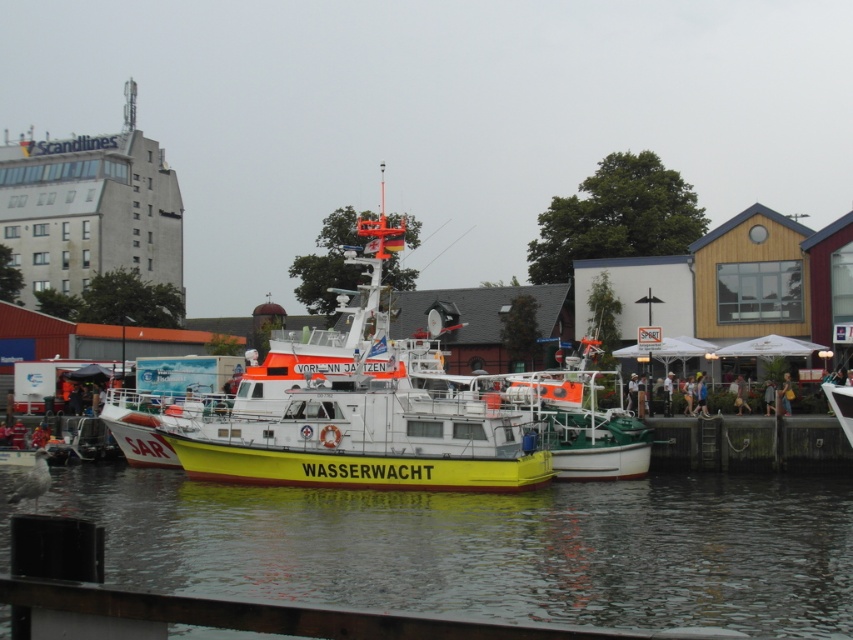
You are a passenger on the yellow matte boat at center and want to jump into the water for a quick swim. Based on the scene description, can you safely jump into the yellow matte water at center from the boat?

The yellow matte water at center is in front of the yellow matte boat at center, so jumping into the water from the boat would place you in the water in front of the boat, which is safe as there are no obstacles mentioned in the scene description.

You are standing on the dock and want to board the SAR rescue boat. The yellow matte water at center is 14.39 meters from you. Is the water close enough for you to safely jump into the SAR boat?

The yellow matte water at center is 14.39 meters from the viewer, which is a significant distance. Jumping from that distance could be dangerous, so it is not advisable to jump into the SAR boat from there.